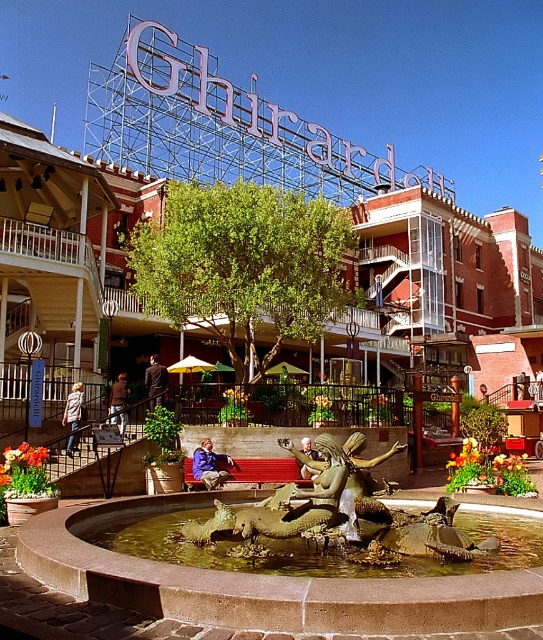
Question: Which object is positioned closest to the brown leather jacket at lower center?

Choices:
 (A) bronze statue at center
 (B) bronze textured sculpture at center

Answer: (B)

Question: From the image, what is the correct spatial relationship of denim jacket at center in relation to denim jacket at lower left?

Choices:
 (A) above
 (B) below

Answer: (B)

Question: Can you confirm if bronze textured sculpture at center is positioned to the left of dark brown leather jacket at center?

Choices:
 (A) yes
 (B) no

Answer: (B)

Question: Which point is closer to the camera?

Choices:
 (A) (16, 275)
 (B) (470, 577)
 (C) (115, 394)

Answer: (B)

Question: Does bronze textured sculpture at center have a larger size compared to brown leather jacket at lower center?

Choices:
 (A) no
 (B) yes

Answer: (B)

Question: Which point is closer to the camera?

Choices:
 (A) coord(161,396)
 (B) coord(56,240)
 (C) coord(305,444)
 (D) coord(71,452)

Answer: (D)